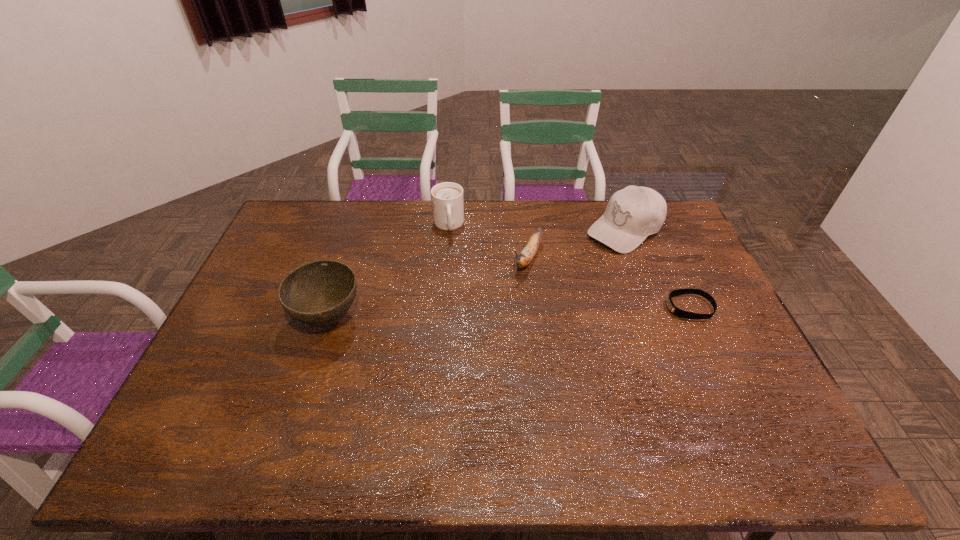
Find the location of a particular element. the leftmost object is located at coordinates (319, 293).

At what (x,y) coordinates should I click in order to perform the action: click on wristband. Please return your answer as a coordinate pair (x, y). This screenshot has width=960, height=540. Looking at the image, I should click on (674, 310).

The height and width of the screenshot is (540, 960). In order to click on baseball cap in this screenshot , I will do `click(632, 214)`.

You are a GUI agent. You are given a task and a screenshot of the screen. Output one action in this format:
    pyautogui.click(x=<x>, y=<y>)
    Task: Click on the third object from left to right
    This screenshot has width=960, height=540.
    Given the screenshot: What is the action you would take?
    pyautogui.click(x=529, y=251)

Where is `banana`? banana is located at coordinates (529, 251).

Where is `cappuccino`? The image size is (960, 540). cappuccino is located at coordinates (447, 198).

Where is `free space located on the back of the leftmost object`? This screenshot has width=960, height=540. free space located on the back of the leftmost object is located at coordinates coord(354,240).

At what (x,y) coordinates should I click in order to perform the action: click on vacant region located on the display of the wristband. Please return your answer as a coordinate pair (x, y). Looking at the image, I should click on [x=563, y=307].

The height and width of the screenshot is (540, 960). I want to click on vacant space located 0.170m on the display of the wristband, so click(x=610, y=307).

Where is `free space located on the display of the wristband`? Image resolution: width=960 pixels, height=540 pixels. free space located on the display of the wristband is located at coordinates (650, 307).